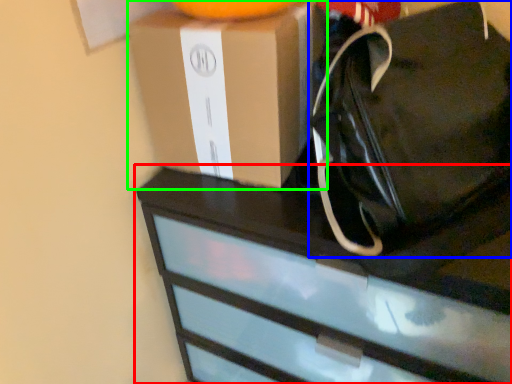
Question: Which object is the farthest from chest of drawers (highlighted by a red box)? Choose among these: tote bag (highlighted by a blue box) or box (highlighted by a green box).

Choices:
 (A) tote bag
 (B) box

Answer: (B)